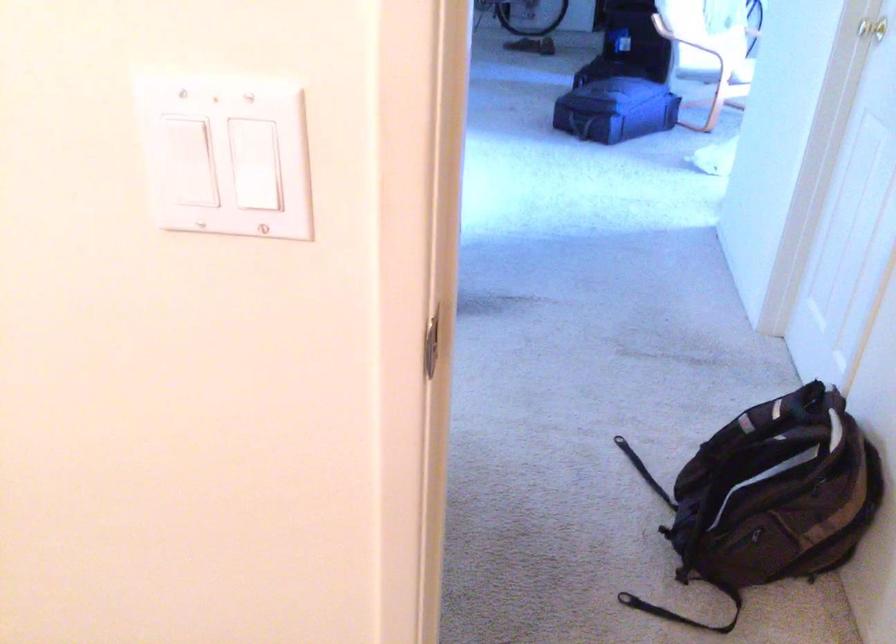
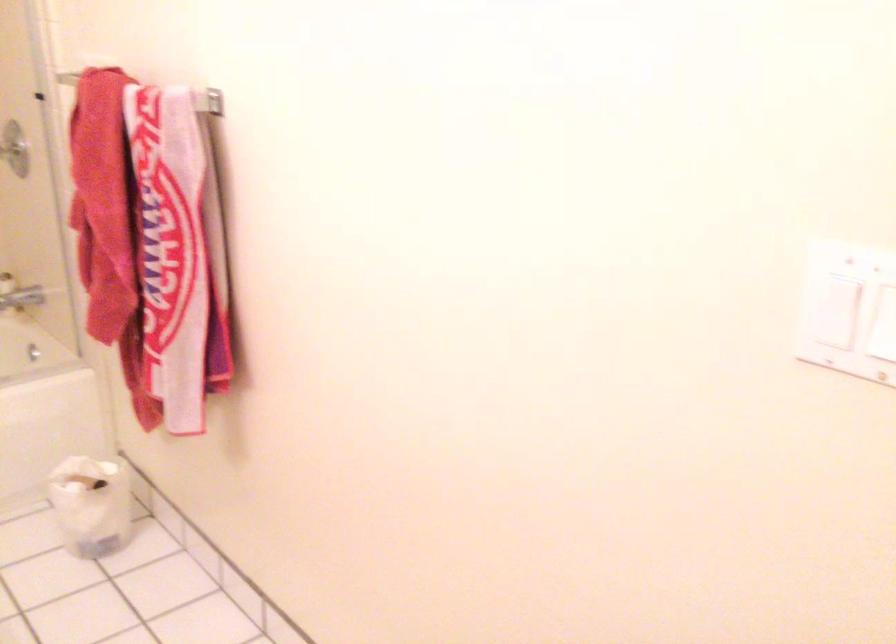
Find the pixel in the second image that matches point (250, 191) in the first image.

(883, 319)